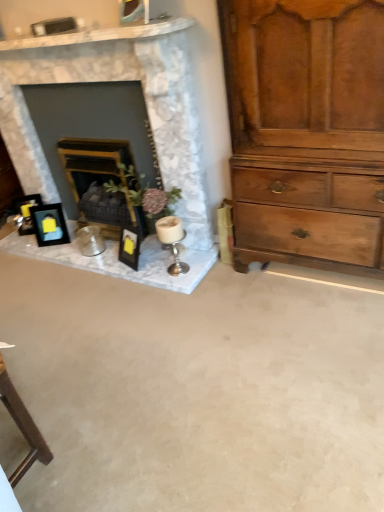
Question: Does light brown wooden chest of drawers at right turn towards silver metallic candle holder at center?

Choices:
 (A) yes
 (B) no

Answer: (B)

Question: Does light brown wooden chest of drawers at right lie in front of silver metallic candle holder at center?

Choices:
 (A) yes
 (B) no

Answer: (A)

Question: Can you confirm if light brown wooden chest of drawers at right is positioned to the right of silver metallic candle holder at center?

Choices:
 (A) yes
 (B) no

Answer: (A)

Question: Is light brown wooden chest of drawers at right oriented away from silver metallic candle holder at center?

Choices:
 (A) yes
 (B) no

Answer: (B)

Question: Does light brown wooden chest of drawers at right have a larger size compared to silver metallic candle holder at center?

Choices:
 (A) no
 (B) yes

Answer: (B)

Question: Is light brown wooden chest of drawers at right to the left or to the right of silver metallic candle holder at center in the image?

Choices:
 (A) right
 (B) left

Answer: (A)

Question: Is light brown wooden chest of drawers at right taller or shorter than silver metallic candle holder at center?

Choices:
 (A) tall
 (B) short

Answer: (A)

Question: Is light brown wooden chest of drawers at right in front of or behind silver metallic candle holder at center in the image?

Choices:
 (A) front
 (B) behind

Answer: (A)

Question: Is light brown wooden chest of drawers at right inside or outside of silver metallic candle holder at center?

Choices:
 (A) inside
 (B) outside

Answer: (B)

Question: From the image's perspective, is matte black picture frame at left, which is the 2th picture frame in left-to-right order, located above or below light brown wooden chest of drawers at right?

Choices:
 (A) below
 (B) above

Answer: (A)

Question: Is matte black picture frame at left, which is the 1th picture frame in right-to-left order, wider or thinner than light brown wooden chest of drawers at right?

Choices:
 (A) thin
 (B) wide

Answer: (A)

Question: Considering the positions of point (54, 218) and point (296, 227), is point (54, 218) closer or farther from the camera than point (296, 227)?

Choices:
 (A) farther
 (B) closer

Answer: (A)

Question: In the image, is matte black picture frame at left, which is the 2th picture frame in left-to-right order, positioned in front of or behind light brown wooden chest of drawers at right?

Choices:
 (A) behind
 (B) front

Answer: (A)

Question: Considering the positions of matte black picture frame at left, which is the 1th picture frame in right-to-left order, and wooden mantelpiece at center, the 1th fireplace when ordered from right to left, in the image, is matte black picture frame at left, which is the 1th picture frame in right-to-left order, taller or shorter than wooden mantelpiece at center, the 1th fireplace when ordered from right to left,?

Choices:
 (A) short
 (B) tall

Answer: (A)

Question: Looking at their shapes, would you say matte black picture frame at left, which is the 1th picture frame in right-to-left order, is wider or thinner than wooden mantelpiece at center, the 1th fireplace when ordered from right to left?

Choices:
 (A) thin
 (B) wide

Answer: (A)